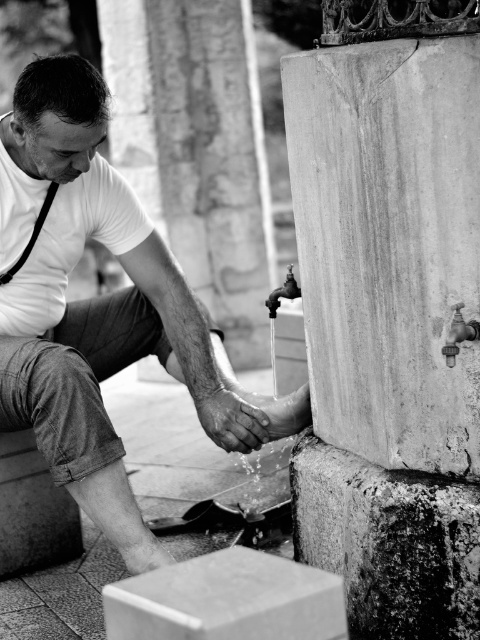
You are standing in front of the fountain and want to place a small potted plant between the smooth stone pillar at right and the black leather suspenders at left. Based on their positions, which object should the plant be closer to?

The smooth stone pillar at right is located below the black leather suspenders at left, so the plant should be placed closer to the smooth stone pillar at right to maintain a balanced arrangement.

You are a photographer trying to capture a closeup of the smooth stone pillar at right and the matte white shirt at left. Your camera has a lens that can focus on objects within a 36 inch range. Can you focus on both objects simultaneously?

The smooth stone pillar at right is 36.48 inches from the matte white shirt at left. Since the distance between them is slightly over 36 inches, the camera lens cannot focus on both objects at the same time.

You are standing at the point with coordinates point (x=10, y=275). You want to walk to the point with coordinates point (x=153, y=243). Which direction should you face to walk towards your destination?

You should face north to walk towards point (x=153, y=243) from point (x=10, y=275) because point (x=153, y=243) is behind point (x=10, y=275).